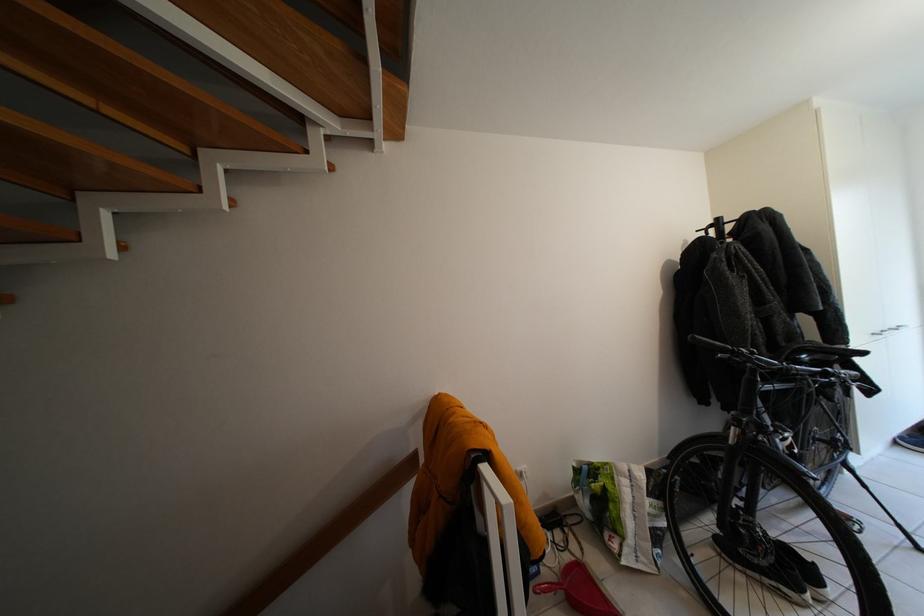
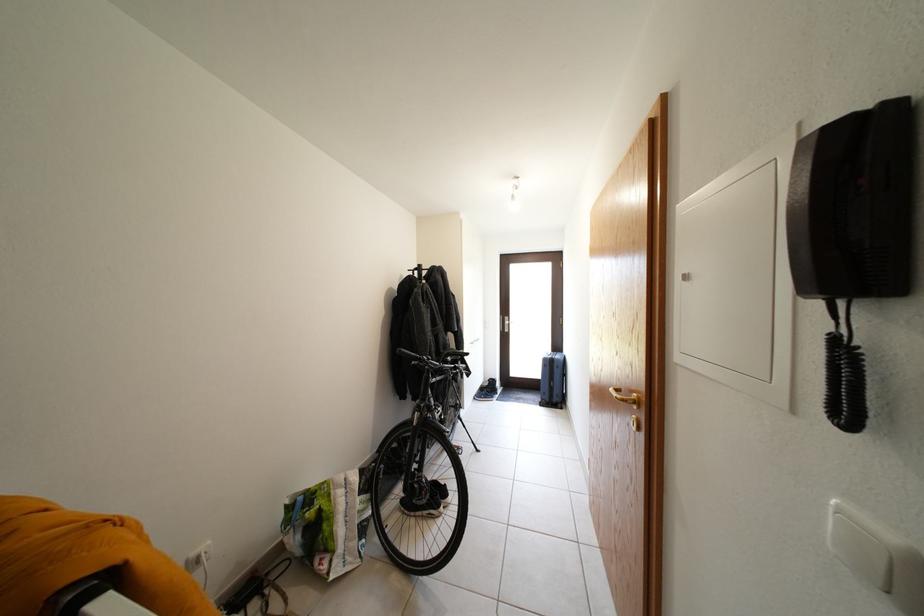
Find the pixel in the second image that matches point (841, 360) in the first image.

(467, 361)